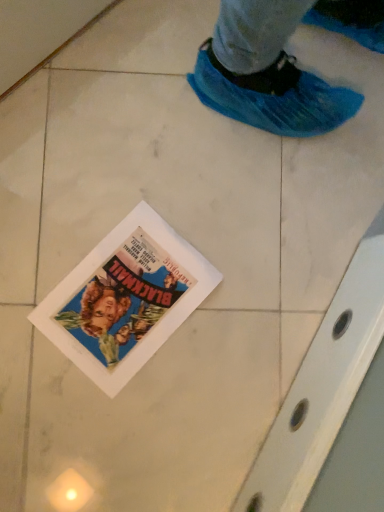
Identify the location of free space in front of white paper at center. (85, 422).